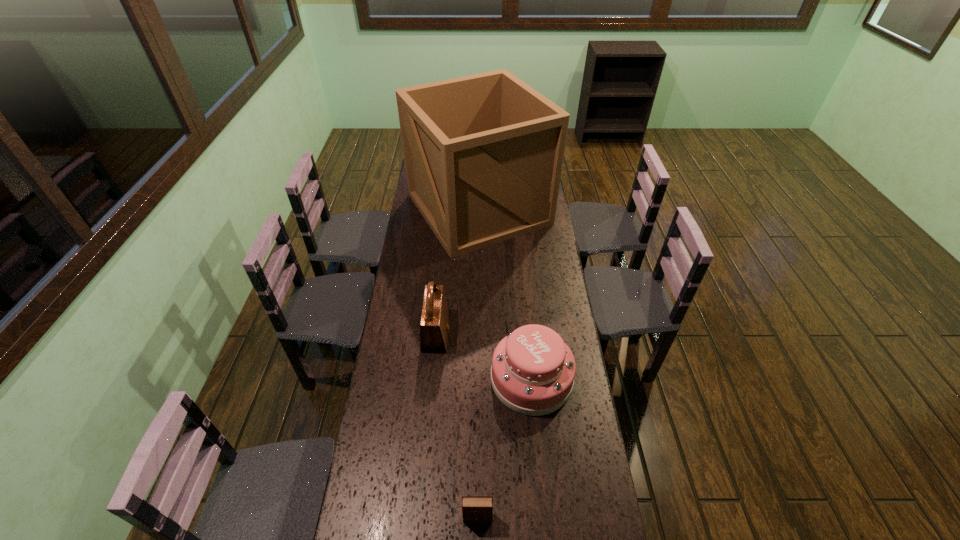
Find the location of a particular element. blank region between the shoulder bag and the diary is located at coordinates (457, 426).

What are the coordinates of `free space between the nearest object and the box` in the screenshot? It's located at (478, 363).

Locate an element on the screen. Image resolution: width=960 pixels, height=540 pixels. free space between the nearest object and the second shortest object is located at coordinates (504, 448).

At what (x,y) coordinates should I click in order to perform the action: click on unoccupied area between the nearest object and the second shortest object. Please return your answer as a coordinate pair (x, y). This screenshot has width=960, height=540. Looking at the image, I should click on (504, 448).

Image resolution: width=960 pixels, height=540 pixels. What are the coordinates of `unoccupied area between the shortest object and the tallest object` in the screenshot? It's located at (478, 363).

The width and height of the screenshot is (960, 540). I want to click on object identified as the second closest to the third shortest object, so click(x=483, y=153).

Where is `object that can be found as the second closest to the shoulder bag`? object that can be found as the second closest to the shoulder bag is located at coordinates (483, 153).

Find the location of a particular element. The width and height of the screenshot is (960, 540). vacant position in the image that satisfies the following two spatial constraints: 1. on the front flap of the cake; 2. on the right side of the third shortest object is located at coordinates (432, 379).

In order to click on free spot that satisfies the following two spatial constraints: 1. on the front flap of the third shortest object; 2. on the back side of the cake in this screenshot , I will do `click(432, 379)`.

Locate an element on the screen. free spot that satisfies the following two spatial constraints: 1. on the back side of the second shortest object; 2. on the front flap of the second tallest object is located at coordinates (527, 334).